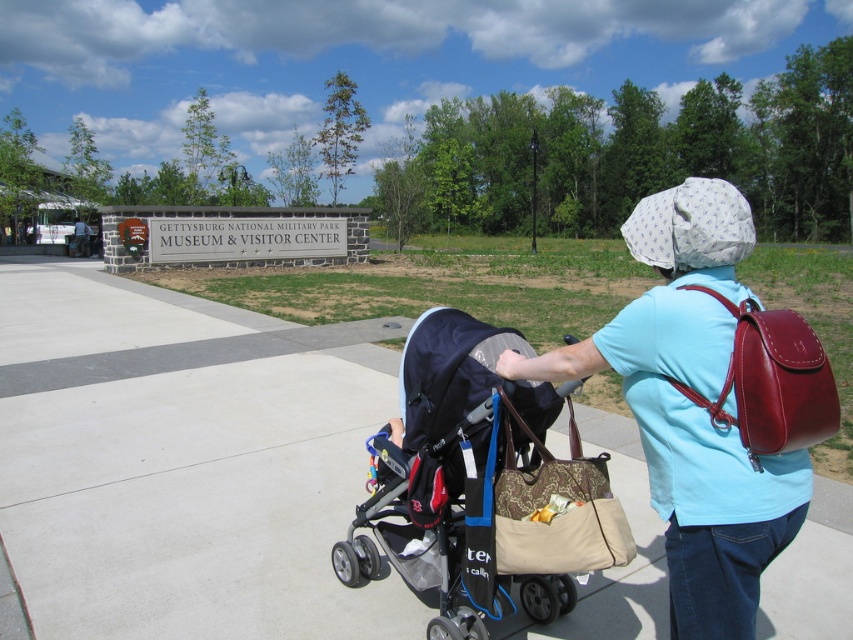
Question: Observing the image, what is the correct spatial positioning of beige fabric tote at center in reference to shiny burgundy leather backpack at upper right?

Choices:
 (A) below
 (B) above

Answer: (A)

Question: Which point is closer to the camera taking this photo?

Choices:
 (A) (634, 410)
 (B) (587, 568)

Answer: (A)

Question: Which object is farther from the camera taking this photo?

Choices:
 (A) dark blue fabric stroller at center
 (B) shiny burgundy leather backpack at upper right
 (C) gray concrete pavement at center
 (D) light blue cotton shirt at center

Answer: (C)

Question: Is dark blue fabric stroller at center wider than light blue cotton shirt at center?

Choices:
 (A) no
 (B) yes

Answer: (B)

Question: Can you confirm if dark blue fabric stroller at center is thinner than light blue cotton shirt at center?

Choices:
 (A) yes
 (B) no

Answer: (B)

Question: Which of the following is the farthest from the observer?

Choices:
 (A) gray concrete pavement at center
 (B) beige fabric tote at center

Answer: (A)